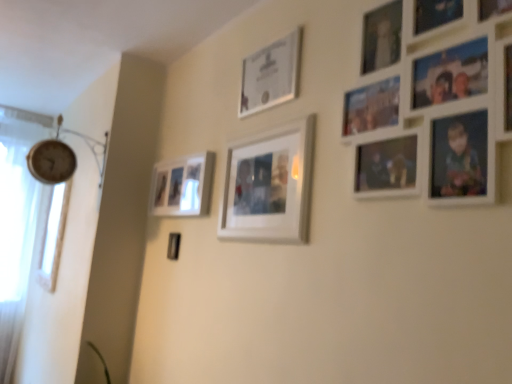
Locate an element on the screen. matte silver frame at upper center, placed as the 2th picture frame when sorted from back to front is located at coordinates (270, 75).

In order to click on clear glass window at left in this screenshot , I will do `click(53, 236)`.

Based on the photo, is the surface of white matte picture frame at upper right, the 4th picture frame when ordered from back to front, in direct contact with matte silver frame at upper center, placed as the 2th picture frame when sorted from back to front?

No, white matte picture frame at upper right, the 4th picture frame when ordered from back to front, is not beside matte silver frame at upper center, placed as the 2th picture frame when sorted from back to front.

From a real-world perspective, is white matte picture frame at upper right, the 4th picture frame when ordered from back to front, physically below matte silver frame at upper center, placed as the 3th picture frame when sorted from left to right?

Correct, in the physical world, white matte picture frame at upper right, the 4th picture frame when ordered from back to front, is lower than matte silver frame at upper center, placed as the 3th picture frame when sorted from left to right.

Considering the relative sizes of white matte picture frame at upper right, which is counted as the 1th picture frame, starting from the right, and matte silver frame at upper center, which ranks as the second picture frame in right-to-left order, in the image provided, is white matte picture frame at upper right, which is counted as the 1th picture frame, starting from the right, shorter than matte silver frame at upper center, which ranks as the second picture frame in right-to-left order,?

Incorrect, the height of white matte picture frame at upper right, which is counted as the 1th picture frame, starting from the right, does not fall short of that of matte silver frame at upper center, which ranks as the second picture frame in right-to-left order.

Is matte silver frame at upper center, which ranks as the second picture frame in right-to-left order, located outside white matte picture frame at upper right, which is counted as the 1th picture frame, starting from the right?

Absolutely, matte silver frame at upper center, which ranks as the second picture frame in right-to-left order, is external to white matte picture frame at upper right, which is counted as the 1th picture frame, starting from the right.

Is matte silver frame at upper center, marked as the third picture frame in a front-to-back arrangement, positioned with its back to white matte picture frame at upper right, the 4th picture frame when ordered from back to front?

No.

Considering the positions of objects matte silver frame at upper center, placed as the 3th picture frame when sorted from left to right, and white matte picture frame at upper right, the 4th picture frame when ordered from left to right, in the image provided, who is more to the left, matte silver frame at upper center, placed as the 3th picture frame when sorted from left to right, or white matte picture frame at upper right, the 4th picture frame when ordered from left to right,?

Positioned to the left is matte silver frame at upper center, placed as the 3th picture frame when sorted from left to right.

Is matte silver frame at upper center, which ranks as the second picture frame in right-to-left order, wider than white matte picture frame at upper right, which is counted as the 1th picture frame, starting from the right?

In fact, matte silver frame at upper center, which ranks as the second picture frame in right-to-left order, might be narrower than white matte picture frame at upper right, which is counted as the 1th picture frame, starting from the right.

Which is farther, (287, 39) or (192, 201)?

Positioned behind is point (192, 201).

Based on their sizes in the image, would you say matte silver frame at upper center, which ranks as the second picture frame in right-to-left order, is bigger or smaller than matte white picture frame at center left, the first picture frame in the back-to-front sequence?

Clearly, matte silver frame at upper center, which ranks as the second picture frame in right-to-left order, is smaller in size than matte white picture frame at center left, the first picture frame in the back-to-front sequence.

Is matte silver frame at upper center, placed as the 3th picture frame when sorted from left to right, not inside matte white picture frame at center left, which is counted as the fourth picture frame, starting from the right?

That's correct, matte silver frame at upper center, placed as the 3th picture frame when sorted from left to right, is outside of matte white picture frame at center left, which is counted as the fourth picture frame, starting from the right.

Is matte silver frame at upper center, placed as the 3th picture frame when sorted from left to right, facing away from matte white picture frame at center left, which is counted as the fourth picture frame, starting from the right?

matte silver frame at upper center, placed as the 3th picture frame when sorted from left to right, is not turned away from matte white picture frame at center left, which is counted as the fourth picture frame, starting from the right.

Locate an element on the screen. picture frame that is the 2nd object above the white matte picture frame at center, arranged as the 2th picture frame when viewed from the left (from a real-world perspective) is located at coordinates (441, 110).

From the image's perspective, which is below, white matte picture frame at center, arranged as the 2th picture frame when viewed from the left, or white matte picture frame at upper right, the 4th picture frame when ordered from back to front?

white matte picture frame at center, arranged as the 2th picture frame when viewed from the left, is shown below in the image.

What's the angular difference between white matte picture frame at center, which is counted as the second picture frame, starting from the front, and white matte picture frame at upper right, the 4th picture frame when ordered from left to right,'s facing directions?

0.00899 degrees.

Can you confirm if white matte picture frame at center, arranged as the 2th picture frame when viewed from the left, is thinner than white matte picture frame at upper right, which is counted as the 1th picture frame, starting from the right?

No, white matte picture frame at center, arranged as the 2th picture frame when viewed from the left, is not thinner than white matte picture frame at upper right, which is counted as the 1th picture frame, starting from the right.

Would you say matte silver frame at upper center, marked as the third picture frame in a front-to-back arrangement, contains clear glass window at left?

No, clear glass window at left is not inside matte silver frame at upper center, marked as the third picture frame in a front-to-back arrangement.

From the picture: Looking at their sizes, would you say matte silver frame at upper center, placed as the 2th picture frame when sorted from back to front, is wider or thinner than clear glass window at left?

Clearly, matte silver frame at upper center, placed as the 2th picture frame when sorted from back to front, has less width compared to clear glass window at left.

From the picture: How different are the orientations of matte silver frame at upper center, which ranks as the second picture frame in right-to-left order, and clear glass window at left in degrees?

They differ by 0.95 degrees in their facing directions.

From the image's perspective, is matte silver frame at upper center, placed as the 3th picture frame when sorted from left to right, beneath clear glass window at left?

Actually, matte silver frame at upper center, placed as the 3th picture frame when sorted from left to right, appears above clear glass window at left in the image.

Which object is closer to the camera taking this photo, white matte picture frame at upper right, which is counted as the 1th picture frame, starting from the front, or white matte picture frame at center, positioned as the third picture frame in right-to-left order?

white matte picture frame at upper right, which is counted as the 1th picture frame, starting from the front, is in front.

From the image's perspective, is white matte picture frame at upper right, which is counted as the 1th picture frame, starting from the right, under white matte picture frame at center, which is counted as the second picture frame, starting from the front?

No, from the image's perspective, white matte picture frame at upper right, which is counted as the 1th picture frame, starting from the right, is not beneath white matte picture frame at center, which is counted as the second picture frame, starting from the front.

Which of these two, white matte picture frame at upper right, the 4th picture frame when ordered from left to right, or white matte picture frame at center, the 3th picture frame when ordered from back to front, is thinner?

white matte picture frame at upper right, the 4th picture frame when ordered from left to right.

Is white matte picture frame at center, the 3th picture frame when ordered from back to front, at the back of white matte picture frame at upper right, which is counted as the 1th picture frame, starting from the right?

No, white matte picture frame at upper right, which is counted as the 1th picture frame, starting from the right, is not facing the opposite direction of white matte picture frame at center, the 3th picture frame when ordered from back to front.

Does matte white picture frame at center left, which is counted as the fourth picture frame, starting from the front, have a lesser height compared to clear glass window at left?

Yes, matte white picture frame at center left, which is counted as the fourth picture frame, starting from the front, is shorter than clear glass window at left.

From the picture: Is matte white picture frame at center left, the first picture frame in the left-to-right sequence, oriented away from clear glass window at left?

matte white picture frame at center left, the first picture frame in the left-to-right sequence, does not have its back to clear glass window at left.

Is matte white picture frame at center left, which is counted as the fourth picture frame, starting from the right, not near clear glass window at left?

Absolutely, matte white picture frame at center left, which is counted as the fourth picture frame, starting from the right, is distant from clear glass window at left.

Which is behind, matte white picture frame at center left, the first picture frame in the left-to-right sequence, or clear glass window at left?

clear glass window at left is further away from the camera.

I want to click on picture frame that is the 2nd object located behind the white matte picture frame at upper right, the 4th picture frame when ordered from left to right, so click(270, 75).

You are a GUI agent. You are given a task and a screenshot of the screen. Output one action in this format:
    pyautogui.click(x=<x>, y=<y>)
    Task: Click on the picture frame that appears above the white matte picture frame at upper right, which is counted as the 1th picture frame, starting from the right (from a real-world perspective)
    
    Given the screenshot: What is the action you would take?
    pyautogui.click(x=270, y=75)

Looking at the image, which one is located closer to clear glass window at left, white matte picture frame at center, positioned as the third picture frame in right-to-left order, or white matte picture frame at upper right, the 4th picture frame when ordered from back to front?

white matte picture frame at center, positioned as the third picture frame in right-to-left order, is positioned closer to the anchor clear glass window at left.

Which object lies further to the anchor point clear glass window at left, matte silver frame at upper center, placed as the 2th picture frame when sorted from back to front, or white matte picture frame at center, positioned as the third picture frame in right-to-left order?

matte silver frame at upper center, placed as the 2th picture frame when sorted from back to front, is positioned further to the anchor clear glass window at left.

When comparing their distances from white matte picture frame at center, which is counted as the second picture frame, starting from the front, does matte white picture frame at center left, the first picture frame in the left-to-right sequence, or matte silver frame at upper center, placed as the 2th picture frame when sorted from back to front, seem further?

matte white picture frame at center left, the first picture frame in the left-to-right sequence, is further to white matte picture frame at center, which is counted as the second picture frame, starting from the front.

Based on their spatial positions, is white matte picture frame at upper right, which is counted as the 1th picture frame, starting from the right, or clear glass window at left further from matte white picture frame at center left, the first picture frame in the left-to-right sequence?

Based on the image, clear glass window at left appears to be further to matte white picture frame at center left, the first picture frame in the left-to-right sequence.

Which object lies further to the anchor point matte white picture frame at center left, which is counted as the fourth picture frame, starting from the right, clear glass window at left or matte silver frame at upper center, which ranks as the second picture frame in right-to-left order?

The object further to matte white picture frame at center left, which is counted as the fourth picture frame, starting from the right, is clear glass window at left.

Considering their positions, is matte silver frame at upper center, placed as the 3th picture frame when sorted from left to right, positioned closer to white matte picture frame at upper right, the 4th picture frame when ordered from back to front, than white matte picture frame at center, which is counted as the second picture frame, starting from the front?

white matte picture frame at center, which is counted as the second picture frame, starting from the front, is positioned closer to the anchor white matte picture frame at upper right, the 4th picture frame when ordered from back to front.

Estimate the real-world distances between objects in this image. Which object is further from clear glass window at left, white matte picture frame at upper right, which is counted as the 1th picture frame, starting from the right, or matte silver frame at upper center, placed as the 3th picture frame when sorted from left to right?

Among the two, white matte picture frame at upper right, which is counted as the 1th picture frame, starting from the right, is located further to clear glass window at left.

Based on the photo, when comparing their distances from white matte picture frame at upper right, which is counted as the 1th picture frame, starting from the front, does matte white picture frame at center left, which is counted as the fourth picture frame, starting from the right, or white matte picture frame at center, arranged as the 2th picture frame when viewed from the left, seem further?

Among the two, matte white picture frame at center left, which is counted as the fourth picture frame, starting from the right, is located further to white matte picture frame at upper right, which is counted as the 1th picture frame, starting from the front.

Image resolution: width=512 pixels, height=384 pixels. In order to click on picture frame located between white matte picture frame at center, which is counted as the second picture frame, starting from the front, and matte white picture frame at center left, which is counted as the fourth picture frame, starting from the right, in the depth direction in this screenshot , I will do `click(270, 75)`.

In order to click on picture frame positioned between white matte picture frame at upper right, which is counted as the 1th picture frame, starting from the front, and matte silver frame at upper center, which ranks as the second picture frame in right-to-left order, from near to far in this screenshot , I will do `click(269, 185)`.

Image resolution: width=512 pixels, height=384 pixels. Identify the location of picture frame between clear glass window at left and white matte picture frame at center, which is counted as the second picture frame, starting from the front, in the horizontal direction. (182, 186).